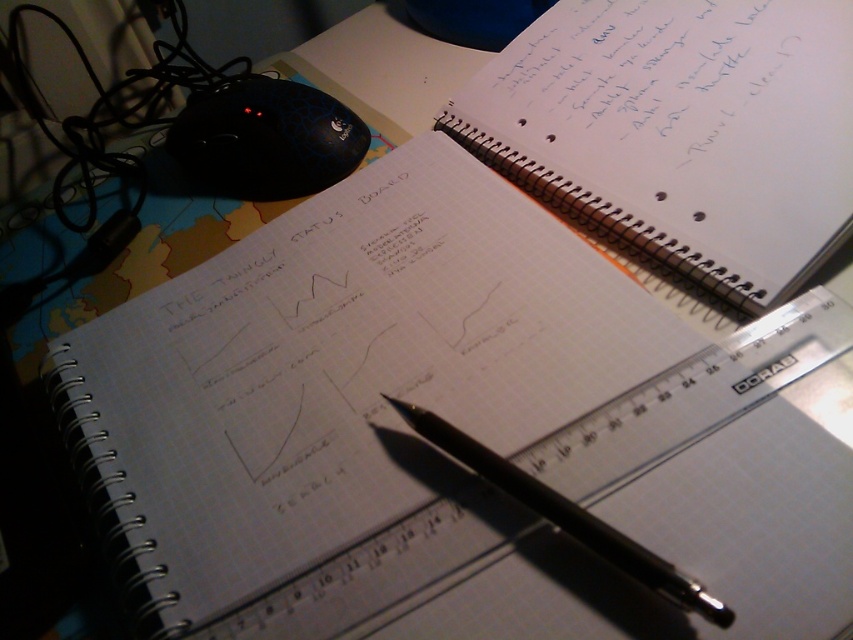
You are organizing your desk and need to place the blue ink writing at upper right and the black metallic pen at center into a drawer. The drawer has a height limit of 10 cm. Can both items fit vertically without bending or damaging them?

The blue ink writing at upper right is taller than the black metallic pen at center. Since the drawer has a height limit of 10 cm, we need to know the exact heights of both items. However, the description only states their relative size. Without specific measurements, it is impossible to determine if both will fit vertically within the 10 cm limit.

What is the location of the blue ink writing at upper right in the image?

The blue ink writing at upper right is located at point (650, 81).